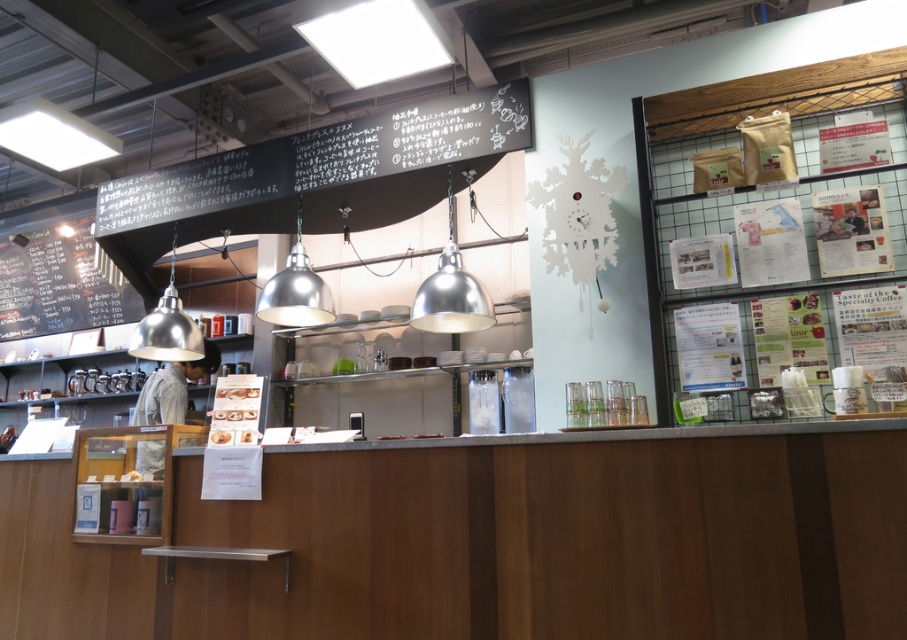
You are a customer standing at the entrance of the cafe. You want to read the black chalkboard menu at upper center. Where should you look to see it?

The black chalkboard menu at upper center is located at point (324,172), so you should look towards the upper center area of the cafe to see it.

You are a customer standing in front of the counter. You want to read both the black chalkboard menu at upper center and the black chalkboard menu at left. Which one is wider?

The black chalkboard menu at upper center is wider than the black chalkboard menu at left.